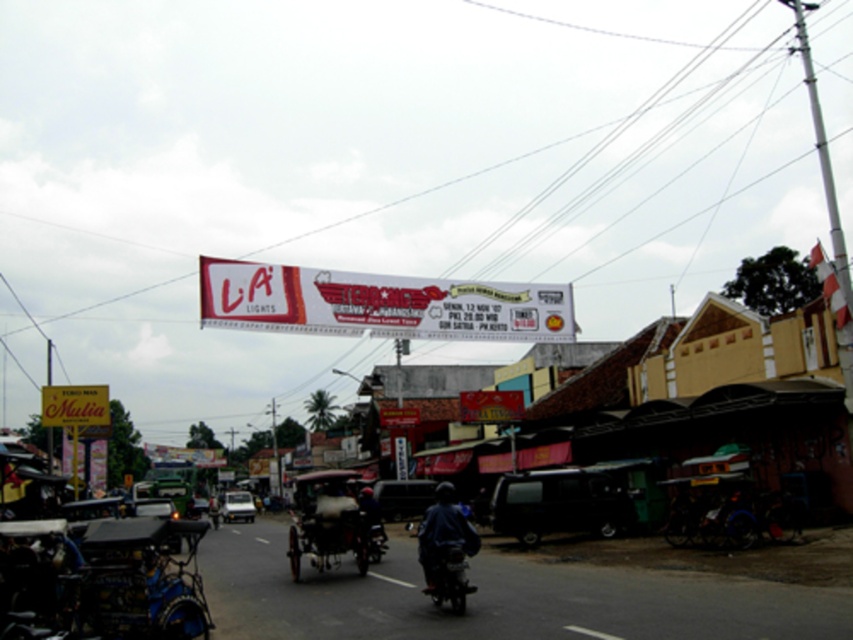
You are a delivery person who needs to pass through the street while avoiding obstacles. The white glossy banner at center and the dark blue matte motorcycle at center are in your path. Which object should you avoid first based on their sizes?

The white glossy banner at center is bigger than the dark blue matte motorcycle at center, so you should avoid the white glossy banner at center first since it is larger and may block your path more significantly.

You are a delivery person trying to navigate through the street. You need to pass by both the white glossy banner at center and the dark blue matte motorcycle at center. Which object should you approach first to ensure safe passage?

You should approach the white glossy banner at center first because it is closer to you than the dark blue matte motorcycle at center, so you need to navigate around it first to ensure safe passage.